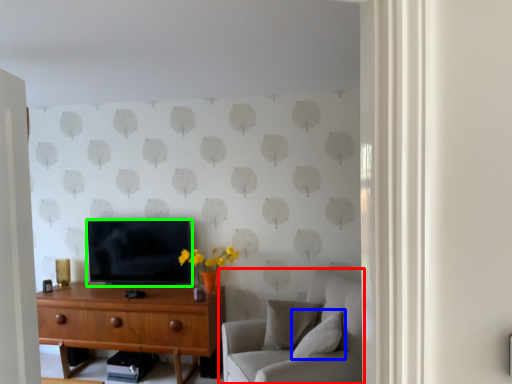
Question: Which object is the farthest from studio couch (highlighted by a red box)? Choose among these: pillow (highlighted by a blue box) or television (highlighted by a green box).

Choices:
 (A) pillow
 (B) television

Answer: (B)